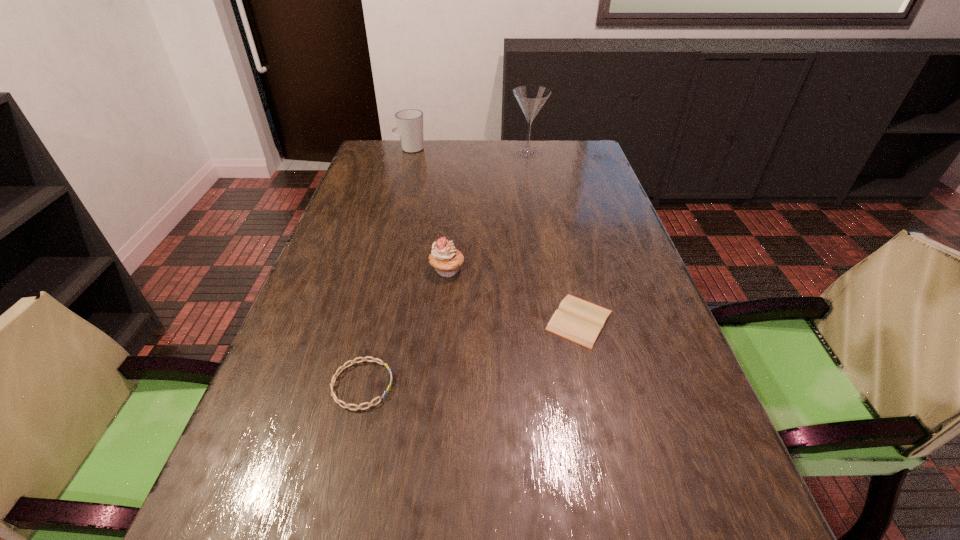
The height and width of the screenshot is (540, 960). I want to click on free space located on the surface of the nearest object showing star-shaped elements, so click(510, 384).

This screenshot has width=960, height=540. In order to click on flute glass that is at the far edge in this screenshot , I will do `click(531, 98)`.

Locate an element on the screen. cup located at the far edge is located at coordinates (409, 122).

You are a GUI agent. You are given a task and a screenshot of the screen. Output one action in this format:
    pyautogui.click(x=<x>, y=<y>)
    Task: Click on the cup that is at the left edge
    
    Given the screenshot: What is the action you would take?
    pyautogui.click(x=409, y=122)

Locate an element on the screen. bracelet situated at the left edge is located at coordinates (343, 367).

Locate an element on the screen. The width and height of the screenshot is (960, 540). object that is at the right edge is located at coordinates point(577,320).

Locate an element on the screen. object located at the far left corner is located at coordinates (409, 122).

Locate an element on the screen. vacant area at the far edge is located at coordinates (436, 156).

At what (x,y) coordinates should I click in order to perform the action: click on free space at the left edge. Please return your answer as a coordinate pair (x, y). The image size is (960, 540). Looking at the image, I should click on (305, 463).

Where is `vacant space at the right edge of the desktop`? Image resolution: width=960 pixels, height=540 pixels. vacant space at the right edge of the desktop is located at coordinates (560, 186).